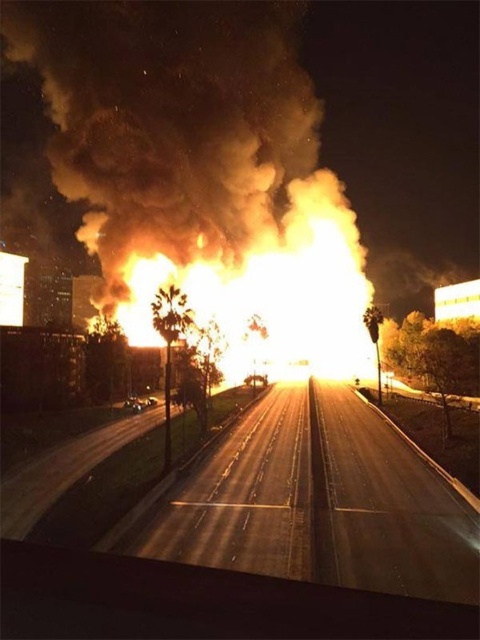
You are a firefighter trying to navigate to the fire scene. You see the fluorescent orange smoke at center and the smooth asphalt highway at center. Which object is closer to the left side of the road?

The fluorescent orange smoke at center is closer to the left side of the road because it is positioned to the left of the smooth asphalt highway at center.

You are a firefighter trying to locate the source of the fire. You see the fluorescent orange smoke at center. What coordinates should you direct your team to investigate?

The fluorescent orange smoke at center is located at coordinates point [201,170], so you should direct your team to investigate the area at point [201,170].

You are a firefighter trying to assess the situation. From your vantage point, which object is above the other between the fluorescent orange smoke at center and the smooth asphalt highway at center?

The fluorescent orange smoke at center is positioned over the smooth asphalt highway at center, meaning the smoke is above the highway.